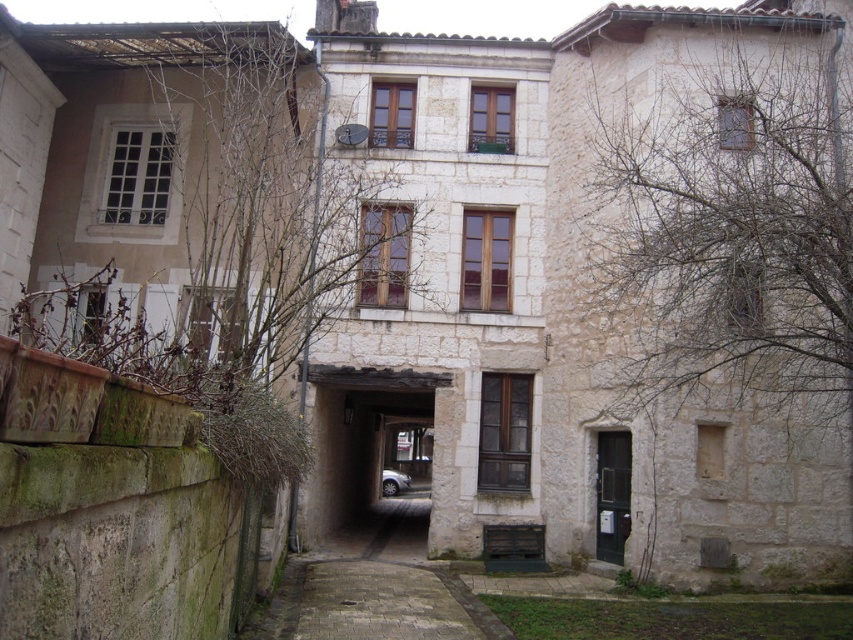
Is bare branches at left positioned in front of bare branches at right?

Yes, bare branches at left is closer to the viewer.

Identify the location of bare branches at left. (190, 230).

Describe the element at coordinates (190, 230) in the screenshot. I see `bare branches at left` at that location.

Is point (173, 364) positioned in front of point (387, 483)?

Yes, it is.

I want to click on bare branches at left, so click(190, 230).

Between bare branches at right and silver metallic car at center, which one appears on the right side from the viewer's perspective?

bare branches at right

Locate an element on the screen. bare branches at right is located at coordinates (730, 230).

Image resolution: width=853 pixels, height=640 pixels. Identify the location of bare branches at right. (730, 230).